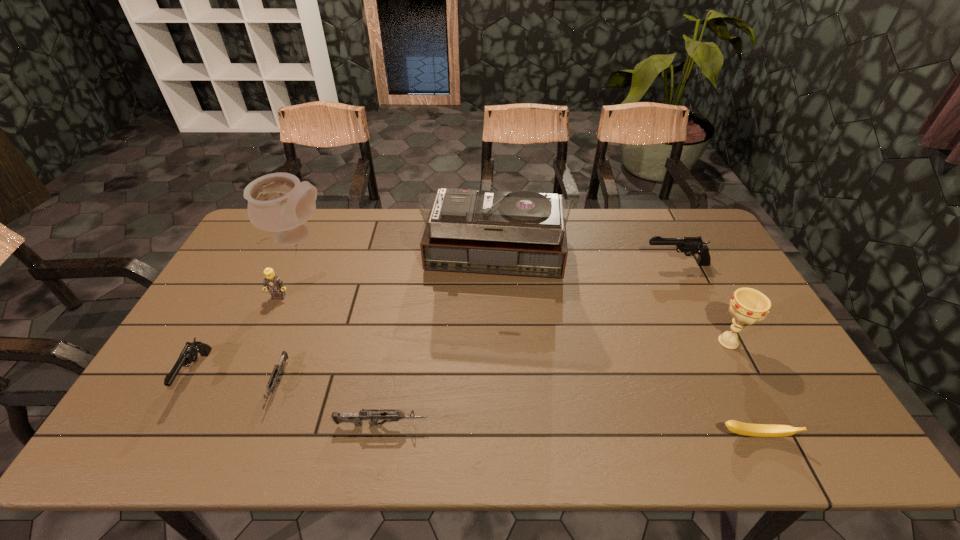
Locate an element on the screen. record player is located at coordinates (523, 233).

Identify the location of pottery. The width and height of the screenshot is (960, 540). (278, 202).

The image size is (960, 540). What are the coordinates of `the second tallest object` in the screenshot? It's located at (278, 202).

This screenshot has height=540, width=960. What are the coordinates of `the seventh shortest object` in the screenshot? It's located at (748, 306).

Locate an element on the screen. This screenshot has height=540, width=960. the right black gun is located at coordinates (689, 246).

Where is `the farther black gun`? the farther black gun is located at coordinates (689, 246).

At what (x,y) coordinates should I click in order to perform the action: click on tan Lego. Please return your answer as a coordinate pair (x, y). Looking at the image, I should click on (272, 282).

This screenshot has height=540, width=960. I want to click on the nearer black gun, so click(189, 354).

Identify the location of the smaller black gun. (189, 354).

Where is `the second shortest gun`? the second shortest gun is located at coordinates (373, 415).